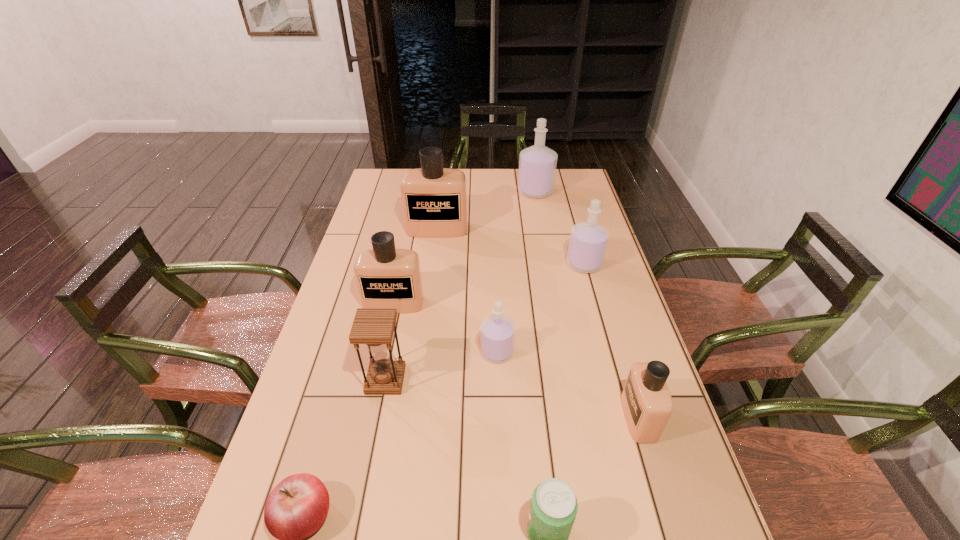
Where is `the fifth nearest object`? The image size is (960, 540). the fifth nearest object is located at coordinates (497, 331).

Identify the location of the rightmost beige perfume. The image size is (960, 540). (647, 404).

What are the coordinates of `the nearest beige perfume` in the screenshot? It's located at [x=647, y=404].

Find the location of a particular element. vacant space located 0.070m on the right of the biggest purple perfume is located at coordinates (570, 191).

This screenshot has height=540, width=960. Find the location of `free space located on the front label of the second farthest object`. free space located on the front label of the second farthest object is located at coordinates (426, 316).

Identify the location of vacant space located 0.270m on the back of the second smallest purple perfume. (569, 210).

Identify the location of blank space located 0.060m on the front label of the second nearest beige perfume. Image resolution: width=960 pixels, height=540 pixels. tap(388, 329).

The height and width of the screenshot is (540, 960). Identify the location of free space located on the front of the hourglass. (369, 468).

The image size is (960, 540). Find the location of `free space located on the left of the fourth perfume from right to left`. free space located on the left of the fourth perfume from right to left is located at coordinates (368, 352).

I want to click on vacant space located 0.080m on the front label of the nearest beige perfume, so click(590, 417).